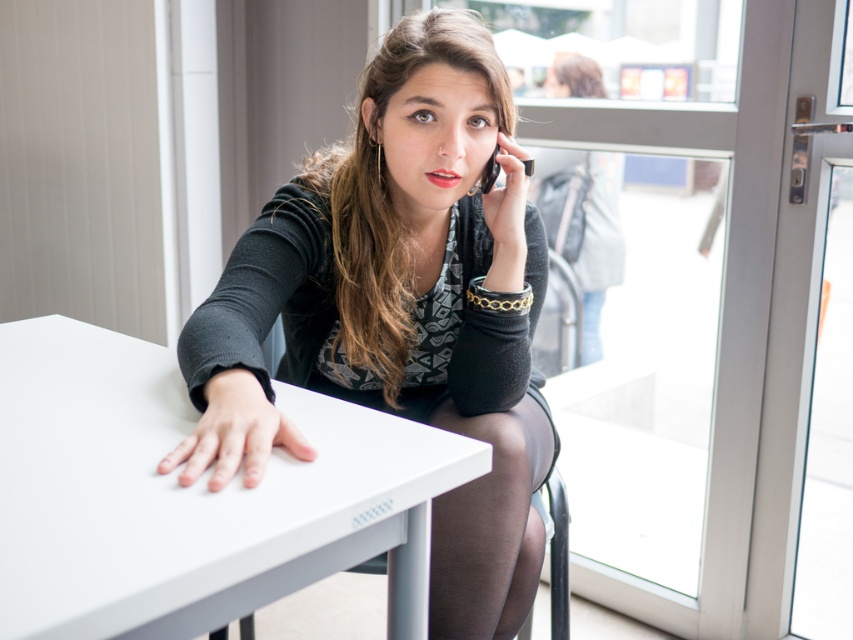
You are a customer in a cafe and want to place your order. The cafe requires you to stand exactly at the point marked as point (399, 308) to be heard by the speaker. You see the matte black sweater at center. Where should you stand relative to the matte black sweater at center to reach the point?

The point (399, 308) is located at the matte black sweater at center, so you should stand right at the matte black sweater at center to reach the required point.

You are a tailor who needs to place a matte black sweater at center and a black plastic phone at upper center on a display table. What is the minimum distance you should keep between them to ensure both items are visible without overlapping?

The matte black sweater at center and black plastic phone at upper center are 28.11 centimeters apart, so you should keep at least 28.11 centimeters between them to ensure both items are visible without overlapping.

You are a photographer standing in front of the white matte table at center and the black plastic phone at upper center. Which object is nearer to you?

The white matte table at center is closer to the viewer than the black plastic phone at upper center.